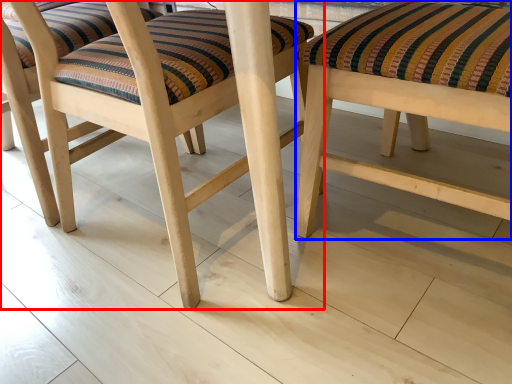
Question: Which point is further to the camera, stool (highlighted by a red box) or stool (highlighted by a blue box)?

Choices:
 (A) stool
 (B) stool

Answer: (A)